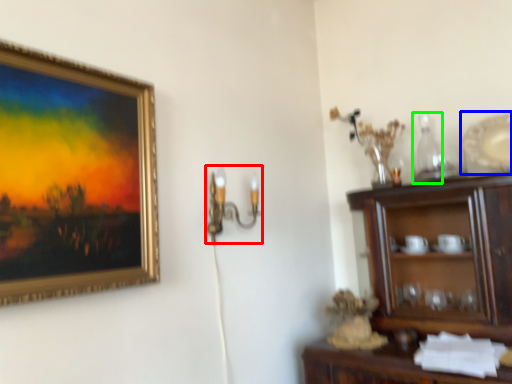
Question: Which is farther away from candle holder (highlighted by a red box)? platter (highlighted by a blue box) or bottle (highlighted by a green box)?

Choices:
 (A) platter
 (B) bottle

Answer: (A)